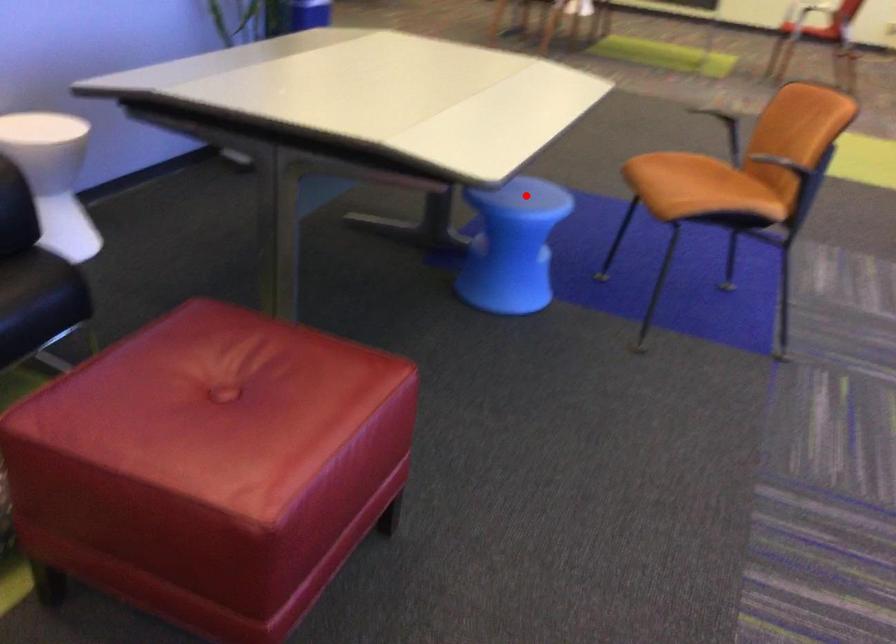
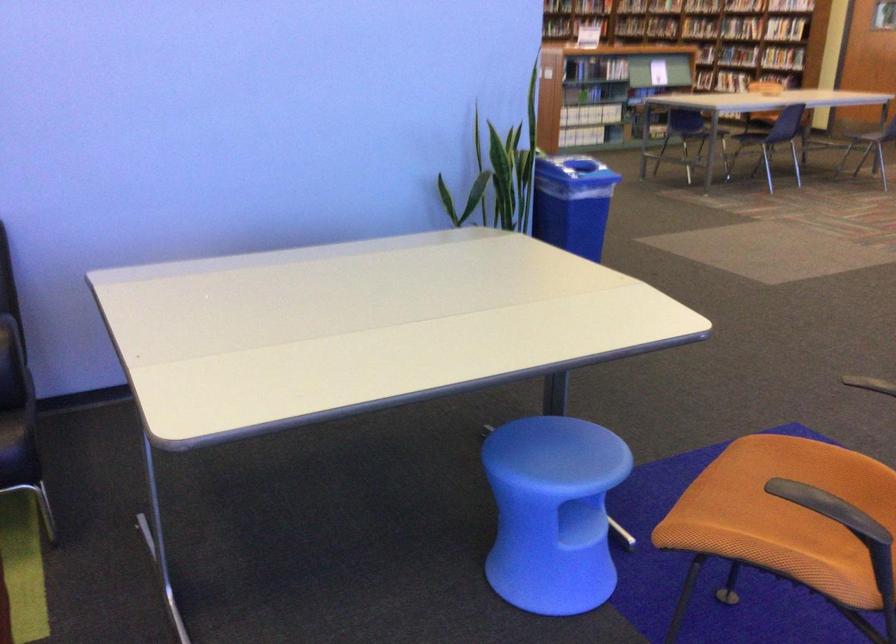
In the second image, find the point that corresponds to the highlighted location in the first image.

(560, 453)